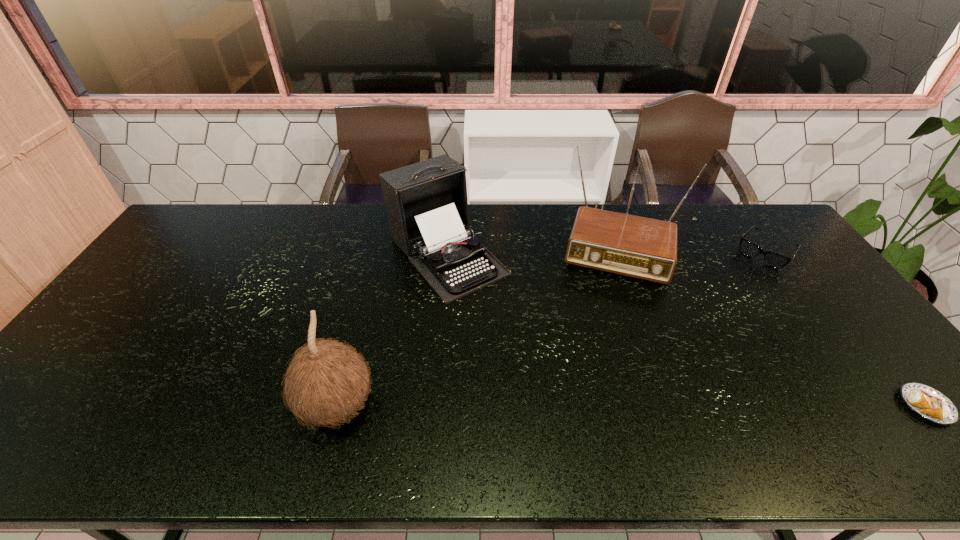
Where is `vacant spot on the desktop that is between the coconut and the pastry and is positioned inside the open case of the typewriter`? The width and height of the screenshot is (960, 540). vacant spot on the desktop that is between the coconut and the pastry and is positioned inside the open case of the typewriter is located at coordinates (588, 406).

Image resolution: width=960 pixels, height=540 pixels. In order to click on vacant space on the desktop that is between the coconut and the shortest object and is positioned on the front-facing side of the sunglasses in this screenshot , I will do `click(637, 406)`.

At what (x,y) coordinates should I click in order to perform the action: click on vacant space on the desktop that is between the coconut and the pastry and is positioned on the front panel of the third object from left to right. Please return your answer as a coordinate pair (x, y). Looking at the image, I should click on (585, 406).